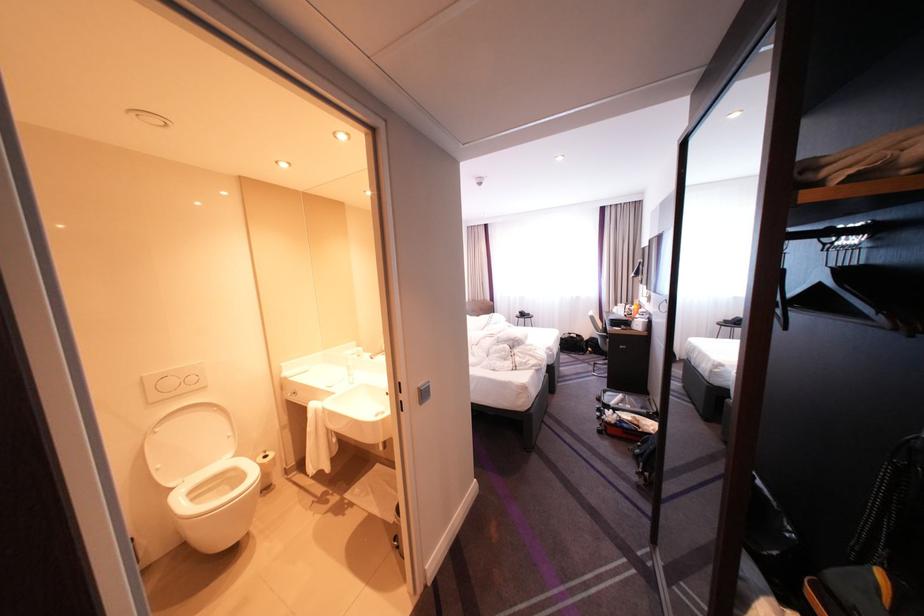
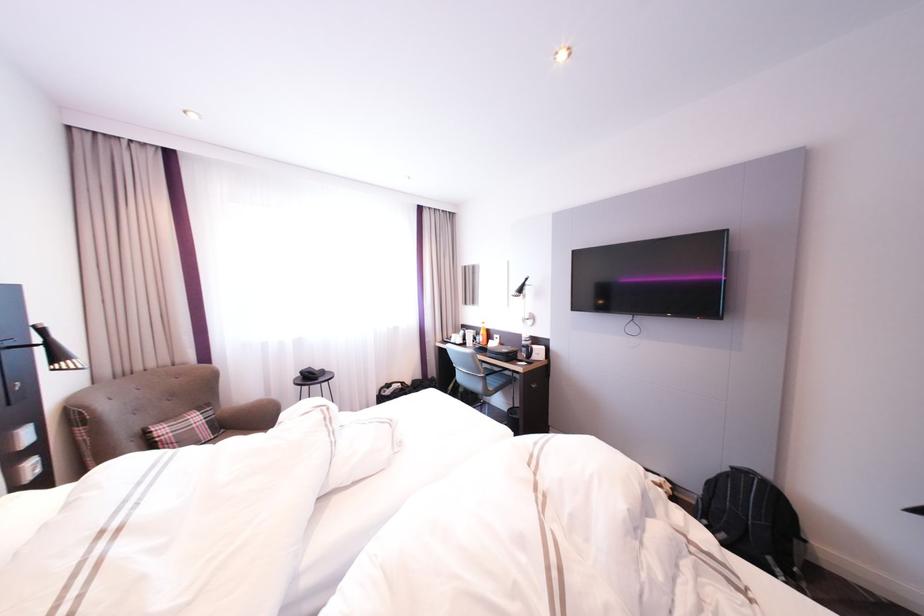
Where in the second image is the point corresponding to point 581,334 from the first image?

(400, 386)